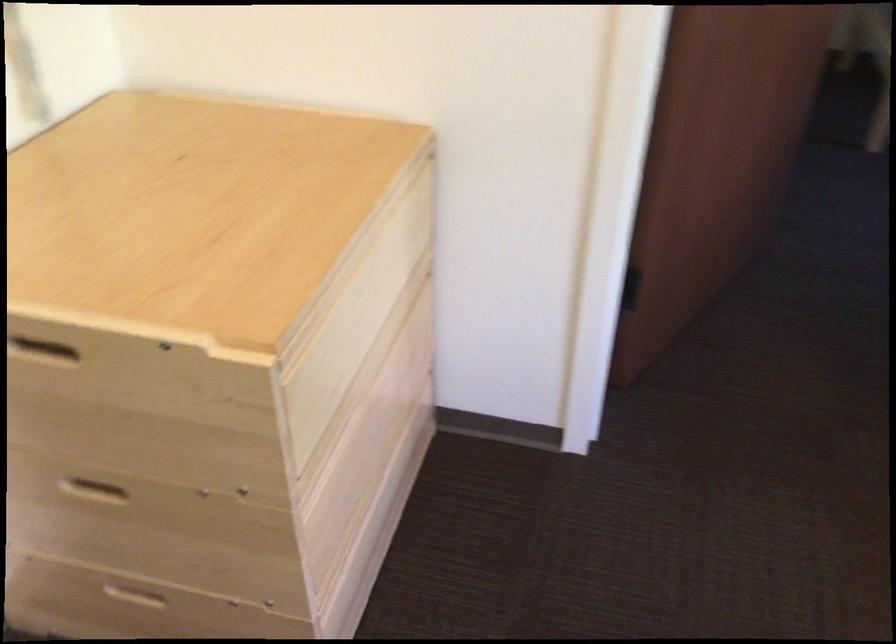
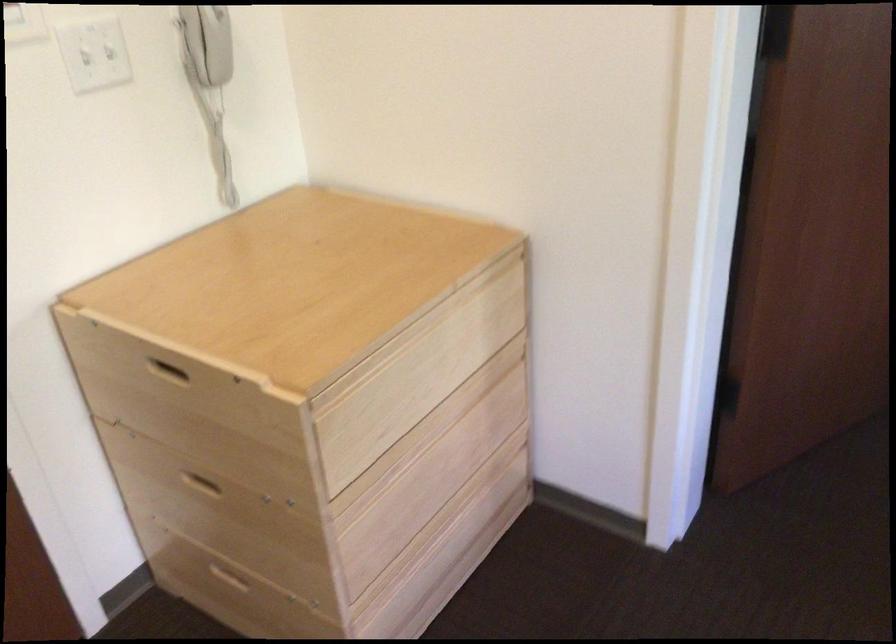
Which direction would the cameraman need to move to produce the second image?

The cameraman moved toward right, backward.